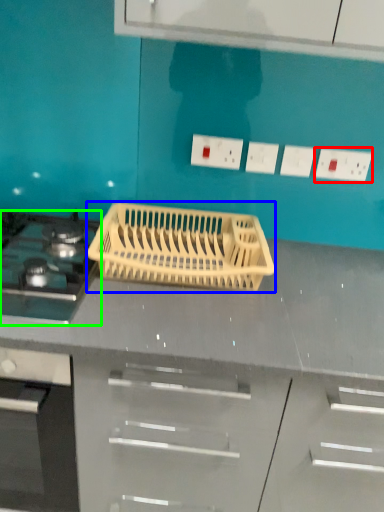
Question: Which is nearer to the electric outlet (highlighted by a red box)? kitchen appliance (highlighted by a blue box) or gas stove (highlighted by a green box).

Choices:
 (A) kitchen appliance
 (B) gas stove

Answer: (A)